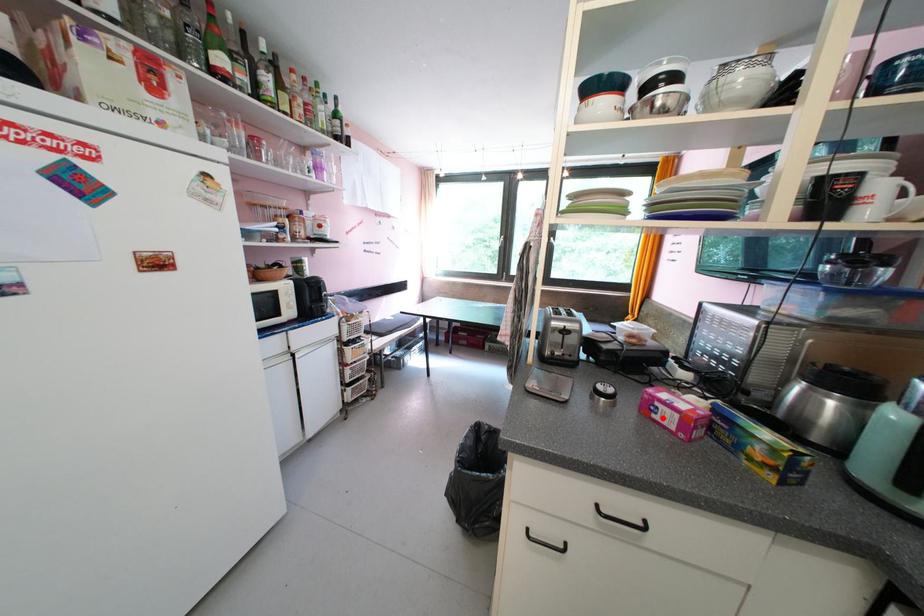
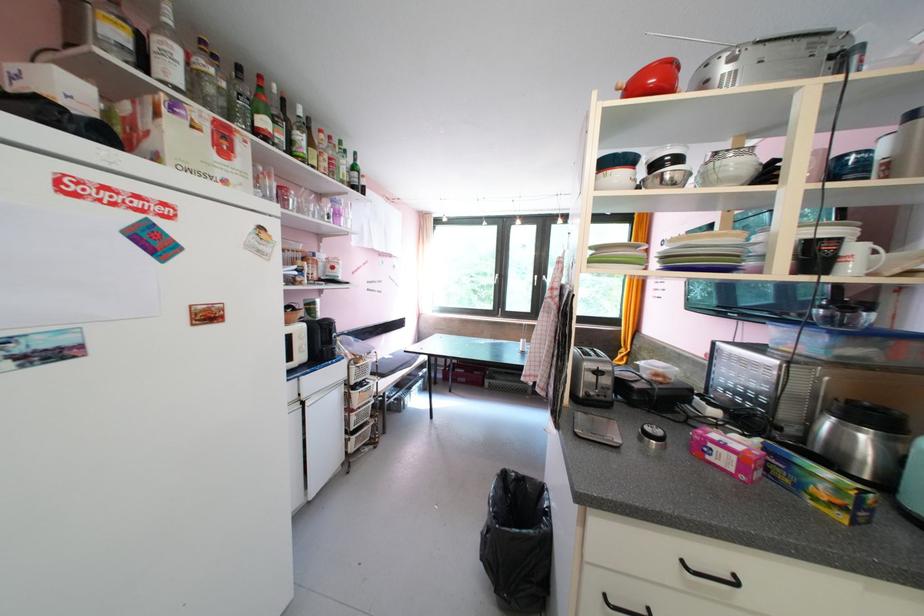
Where in the second image is the point corresponding to the highlighted location from the first image?

(716, 460)